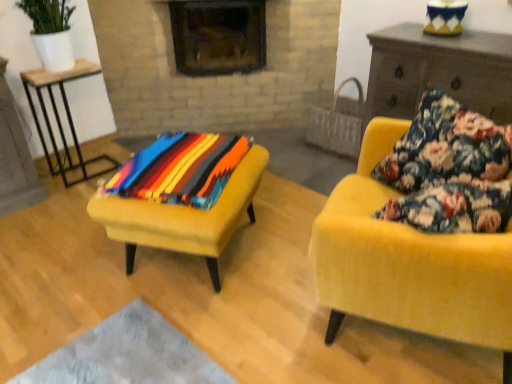
This screenshot has height=384, width=512. What are the coordinates of `white ceramic pot at upper left` in the screenshot? It's located at (50, 32).

This screenshot has height=384, width=512. In order to click on wooden dresser at right in this screenshot , I will do `click(438, 71)`.

The image size is (512, 384). What do you see at coordinates (438, 71) in the screenshot? I see `wooden dresser at right` at bounding box center [438, 71].

What do you see at coordinates (181, 169) in the screenshot? This screenshot has height=384, width=512. I see `multicolored woven blanket at center` at bounding box center [181, 169].

The width and height of the screenshot is (512, 384). Describe the element at coordinates (423, 228) in the screenshot. I see `velvet yellow armchair at right` at that location.

What is the approximate width of brick fireplace at upper center?

It is 17.13 inches.

The image size is (512, 384). What do you see at coordinates (183, 217) in the screenshot?
I see `velvet yellow stool at center` at bounding box center [183, 217].

What is the approximate height of velvet yellow stool at center?

17.05 inches.

I want to click on white ceramic pot at upper left, so click(50, 32).

Can you tell me how much floral fabric pillow at right and white ceramic pot at upper left differ in facing direction?

The angle between the facing direction of floral fabric pillow at right and the facing direction of white ceramic pot at upper left is 103 degrees.

Find the location of `pillow to the right of white ceramic pot at upper left`. pillow to the right of white ceramic pot at upper left is located at coordinates (446, 147).

From the image's perspective, which one is positioned lower, floral fabric pillow at right or white ceramic pot at upper left?

floral fabric pillow at right appears lower in the image.

From a real-world perspective, is floral fabric pillow at right positioned over white ceramic pot at upper left based on gravity?

No, from a real-world perspective, floral fabric pillow at right is not over white ceramic pot at upper left

How different are the orientations of brick fireplace at upper center and wooden dresser at right in degrees?

47.6 degrees separate the facing orientations of brick fireplace at upper center and wooden dresser at right.

Is the surface of brick fireplace at upper center in direct contact with wooden dresser at right?

No, brick fireplace at upper center is not touching wooden dresser at right.

Which is more to the right, brick fireplace at upper center or wooden dresser at right?

wooden dresser at right is more to the right.

Find the location of `houseplant above the velvet yellow stool at center (from the image's perspective)`. houseplant above the velvet yellow stool at center (from the image's perspective) is located at coordinates (50, 32).

Are velvet yellow stool at center and white ceramic pot at upper left far apart?

velvet yellow stool at center is positioned a significant distance from white ceramic pot at upper left.

Is velvet yellow stool at center outside of white ceramic pot at upper left?

Absolutely, velvet yellow stool at center is external to white ceramic pot at upper left.

Is point (130, 227) farther from viewer compared to point (25, 7)?

No, it is in front of (25, 7).

Is velvet yellow stool at center thinner than woven straw picnic basket at center?

No.

Which is behind, point (108, 231) or point (340, 96)?

The point (340, 96) is farther.

Is velvet yellow stool at center not near woven straw picnic basket at center?

Yes, velvet yellow stool at center is far from woven straw picnic basket at center.

Considering the sizes of objects velvet yellow stool at center and woven straw picnic basket at center in the image provided, who is shorter, velvet yellow stool at center or woven straw picnic basket at center?

With less height is velvet yellow stool at center.

From a real-world perspective, is wooden dresser at right beneath wooden table at left?

No, from a real-world perspective, wooden dresser at right is not below wooden table at left.

Which object is positioned more to the left, wooden dresser at right or wooden table at left?

Positioned to the left is wooden table at left.

Which object is wider, wooden dresser at right or wooden table at left?

wooden dresser at right is wider.

From the image's perspective, is white ceramic pot at upper left over brick fireplace at upper center?

No, from the image's perspective, white ceramic pot at upper left is not above brick fireplace at upper center.

Is white ceramic pot at upper left facing towards brick fireplace at upper center?

No, white ceramic pot at upper left is not oriented towards brick fireplace at upper center.

Based on their sizes in the image, would you say white ceramic pot at upper left is bigger or smaller than brick fireplace at upper center?

white ceramic pot at upper left is smaller than brick fireplace at upper center.

Relative to brick fireplace at upper center, is white ceramic pot at upper left in front or behind?

white ceramic pot at upper left is in front of brick fireplace at upper center.

Who is smaller, multicolored woven blanket at center or woven straw picnic basket at center?

With smaller size is multicolored woven blanket at center.

Is point (223, 162) closer or farther from the camera than point (331, 139)?

Clearly, point (223, 162) is closer to the camera than point (331, 139).

From their relative heights in the image, would you say multicolored woven blanket at center is taller or shorter than woven straw picnic basket at center?

multicolored woven blanket at center is shorter than woven straw picnic basket at center.

From the image's perspective, who appears lower, multicolored woven blanket at center or woven straw picnic basket at center?

multicolored woven blanket at center appears lower in the image.

What are the coordinates of `pillow lying in front of the white ceramic pot at upper left` in the screenshot? It's located at (446, 147).

At what (x,y) coordinates should I click in order to perform the action: click on fireplace located above the wooden dresser at right (from the image's perspective). Please return your answer as a coordinate pair (x, y). This screenshot has width=512, height=384. Looking at the image, I should click on (218, 36).

From the image, which object appears to be farther from brick fireplace at upper center, floral fabric pillow at right or wooden dresser at right?

floral fabric pillow at right.

Considering their positions, is wooden dresser at right positioned further to floral fabric pillow at right than velvet yellow armchair at right?

wooden dresser at right is positioned further to the anchor floral fabric pillow at right.

Looking at the image, which one is located closer to multicolored woven blanket at center, brick fireplace at upper center or wooden table at left?

The object closer to multicolored woven blanket at center is wooden table at left.

Considering their positions, is brick fireplace at upper center positioned further to white ceramic pot at upper left than wooden table at left?

Based on the image, brick fireplace at upper center appears to be further to white ceramic pot at upper left.

Estimate the real-world distances between objects in this image. Which object is further from velvet yellow armchair at right, woven straw picnic basket at center or white ceramic pot at upper left?

white ceramic pot at upper left.

Based on their spatial positions, is wooden table at left or brick fireplace at upper center further from velvet yellow stool at center?

brick fireplace at upper center is further to velvet yellow stool at center.

Based on their spatial positions, is floral fabric pillow at right or wooden dresser at right closer to multicolored woven blanket at center?

floral fabric pillow at right.

Which object lies further to the anchor point white ceramic pot at upper left, multicolored woven blanket at center or floral fabric pillow at right?

floral fabric pillow at right lies further to white ceramic pot at upper left than the other object.

This screenshot has height=384, width=512. I want to click on picnic basket between velvet yellow stool at center and brick fireplace at upper center in the front-back direction, so click(338, 123).

The width and height of the screenshot is (512, 384). I want to click on blanket that lies between white ceramic pot at upper left and velvet yellow stool at center from top to bottom, so click(181, 169).

This screenshot has height=384, width=512. Find the location of `houseplant located between multicolored woven blanket at center and brick fireplace at upper center in the depth direction`. houseplant located between multicolored woven blanket at center and brick fireplace at upper center in the depth direction is located at coordinates (50, 32).

Find the location of `blanket between floral fabric pillow at right and brick fireplace at upper center from front to back`. blanket between floral fabric pillow at right and brick fireplace at upper center from front to back is located at coordinates (181, 169).